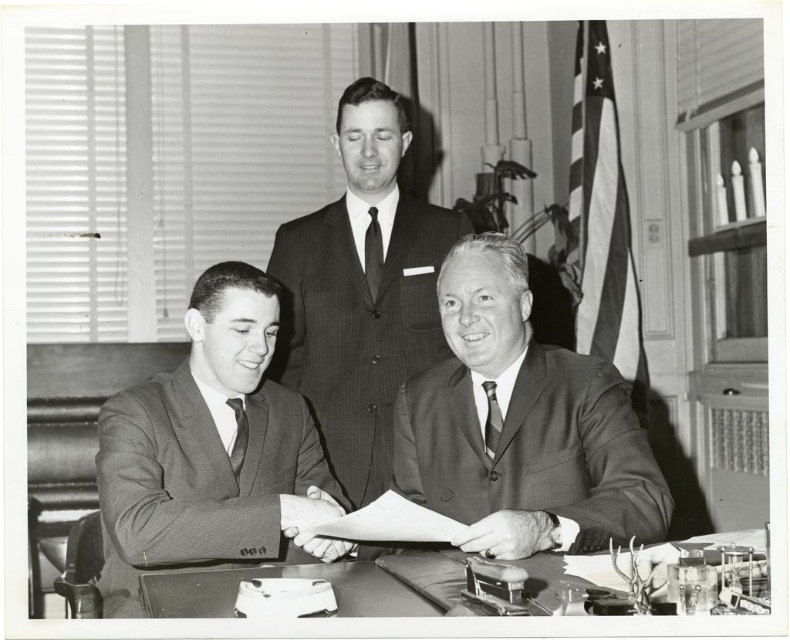
You are standing in the room and need to determine the location of the smooth brown suit at center. According to the coordinates provided, where would you find it?

The smooth brown suit at center is located at point (521,424).

You are a photographer who wants to capture a closeup shot of the dark gray textured tie at center without the glossy wooden table at center appearing in the frame. Is this possible given their sizes?

The glossy wooden table at center has a larger size compared to dark gray textured tie at center, so it might be challenging to frame the dark gray textured tie at center without including the glossy wooden table at center due to its larger presence in the scene.

You are a photographer who needs to capture a closeup shot of the dark gray textured tie at center without including the glossy wooden table at center in the frame. Is this possible given their positions?

The glossy wooden table at center is located below the dark gray textured tie at center, so it is possible to frame the shot to focus on the dark gray textured tie at center while excluding the glossy wooden table at center by adjusting the camera angle upwards.